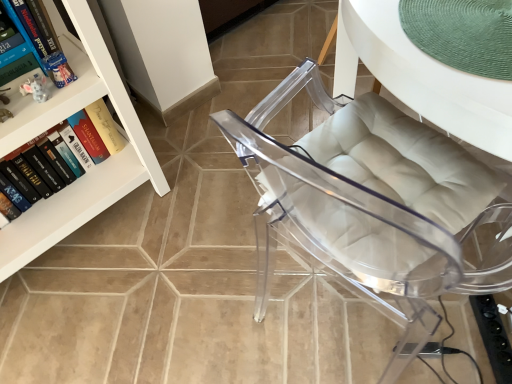
The height and width of the screenshot is (384, 512). What do you see at coordinates (86, 138) in the screenshot?
I see `hardcover book at left, acting as the first book starting from the bottom` at bounding box center [86, 138].

This screenshot has height=384, width=512. What do you see at coordinates (27, 29) in the screenshot?
I see `hardcover book at upper left, arranged as the 2th book when ordered from the bottom` at bounding box center [27, 29].

Describe the element at coordinates (59, 122) in the screenshot. I see `white glossy bookcase at upper left` at that location.

Where is `green woven placemat at upper right`? Image resolution: width=512 pixels, height=384 pixels. green woven placemat at upper right is located at coordinates (421, 77).

Identify the location of hardcover book at left, which is counted as the 2th book, starting from the top. This screenshot has width=512, height=384. (86, 138).

Is hardcover book at left, which is counted as the 2th book, starting from the top, facing away from white glossy bookcase at upper left?

Correct, hardcover book at left, which is counted as the 2th book, starting from the top, is looking away from white glossy bookcase at upper left.

Is hardcover book at left, which is counted as the 2th book, starting from the top, completely or partially outside of white glossy bookcase at upper left?

That's incorrect, hardcover book at left, which is counted as the 2th book, starting from the top, is not completely outside white glossy bookcase at upper left.

Which of these two, hardcover book at left, which is counted as the 2th book, starting from the top, or white glossy bookcase at upper left, is smaller?

hardcover book at left, which is counted as the 2th book, starting from the top.

Considering the positions of point (82, 129) and point (25, 246), is point (82, 129) closer or farther from the camera than point (25, 246)?

Point (82, 129) is farther from the camera than point (25, 246).

This screenshot has width=512, height=384. What are the coordinates of `chair above the hardcover book at left, acting as the first book starting from the bottom (from a real-world perspective)` in the screenshot? It's located at (348, 226).

Which is nearer, (104,130) or (453,237)?

The point (453,237) is closer to the camera.

Can you confirm if hardcover book at left, which is counted as the 2th book, starting from the top, is wider than transparent acrylic chair at center?

No.

From the image's perspective, relative to transparent acrylic chair at center, is hardcover book at left, acting as the first book starting from the bottom, above or below?

hardcover book at left, acting as the first book starting from the bottom, is situated lower than transparent acrylic chair at center in the image.

Which of these two, hardcover book at left, which is counted as the 2th book, starting from the top, or hardcover book at upper left, arranged as the 2th book when ordered from the bottom, is smaller?

hardcover book at upper left, arranged as the 2th book when ordered from the bottom.

Consider the image. Can you confirm if hardcover book at left, acting as the first book starting from the bottom, is positioned to the left of hardcover book at upper left, which appears as the first book when viewed from the top?

Yes.

Is hardcover book at left, which is counted as the 2th book, starting from the top, aimed at hardcover book at upper left, which appears as the first book when viewed from the top?

No.

Looking at this image, from a real-world perspective, which is physically above, hardcover book at upper left, arranged as the 2th book when ordered from the bottom, or white glossy bookcase at upper left?

A: hardcover book at upper left, arranged as the 2th book when ordered from the bottom.

Could you measure the distance between hardcover book at upper left, arranged as the 2th book when ordered from the bottom, and white glossy bookcase at upper left?

They are 9.41 inches apart.

At what (x,y) coordinates should I click in order to perform the action: click on book located above the white glossy bookcase at upper left (from the image's perspective). Please return your answer as a coordinate pair (x, y). Image resolution: width=512 pixels, height=384 pixels. Looking at the image, I should click on (27, 29).

Considering the sizes of objects hardcover book at upper left, which appears as the first book when viewed from the top, and white glossy bookcase at upper left in the image provided, who is wider, hardcover book at upper left, which appears as the first book when viewed from the top, or white glossy bookcase at upper left?

Wider between the two is white glossy bookcase at upper left.

Is green woven placemat at upper right inside transparent acrylic chair at center?

That's correct, green woven placemat at upper right is inside transparent acrylic chair at center.

Is transparent acrylic chair at center positioned far away from green woven placemat at upper right?

transparent acrylic chair at center is actually quite close to green woven placemat at upper right.

How much distance is there between transparent acrylic chair at center and green woven placemat at upper right?

The distance of transparent acrylic chair at center from green woven placemat at upper right is 26.10 centimeters.

Considering the relative sizes of transparent acrylic chair at center and green woven placemat at upper right in the image provided, is transparent acrylic chair at center taller than green woven placemat at upper right?

Yes.

You are a GUI agent. You are given a task and a screenshot of the screen. Output one action in this format:
    pyautogui.click(x=<x>, y=<y>)
    Task: Click on the bookcase lying above the hardcover book at left, which is counted as the 2th book, starting from the top (from the image's perspective)
    
    Given the screenshot: What is the action you would take?
    pyautogui.click(x=59, y=122)

Looking at this image, is white glossy bookcase at upper left turned away from hardcover book at left, acting as the first book starting from the bottom?

Yes.

How much distance is there between white glossy bookcase at upper left and hardcover book at left, acting as the first book starting from the bottom?

They are 5.02 inches apart.

In the scene shown: From the image's perspective, which object appears higher, white glossy bookcase at upper left or hardcover book at left, which is counted as the 2th book, starting from the top?

white glossy bookcase at upper left appears higher in the image.

From the image's perspective, is green woven placemat at upper right above or below white glossy bookcase at upper left?

From the image's perspective, green woven placemat at upper right appears above white glossy bookcase at upper left.

Would you say green woven placemat at upper right is outside white glossy bookcase at upper left?

green woven placemat at upper right is positioned outside white glossy bookcase at upper left.

Can you tell me how much green woven placemat at upper right and white glossy bookcase at upper left differ in facing direction?

107 degrees separate the facing orientations of green woven placemat at upper right and white glossy bookcase at upper left.

At what (x,y) coordinates should I click in order to perform the action: click on the 2nd book behind the white glossy bookcase at upper left. Please return your answer as a coordinate pair (x, y). This screenshot has width=512, height=384. Looking at the image, I should click on (86, 138).

The width and height of the screenshot is (512, 384). I want to click on chair that appears in front of the hardcover book at left, which is counted as the 2th book, starting from the top, so click(x=348, y=226).

Based on their spatial positions, is white glossy bookcase at upper left or green woven placemat at upper right closer to hardcover book at upper left, which appears as the first book when viewed from the top?

white glossy bookcase at upper left.

Based on their spatial positions, is white glossy bookcase at upper left or hardcover book at upper left, which appears as the first book when viewed from the top, closer to hardcover book at left, which is counted as the 2th book, starting from the top?

white glossy bookcase at upper left lies closer to hardcover book at left, which is counted as the 2th book, starting from the top, than the other object.

Which object lies nearer to the anchor point white glossy bookcase at upper left, hardcover book at left, acting as the first book starting from the bottom, or green woven placemat at upper right?

Among the two, hardcover book at left, acting as the first book starting from the bottom, is located nearer to white glossy bookcase at upper left.

Which object lies further to the anchor point hardcover book at left, which is counted as the 2th book, starting from the top, transparent acrylic chair at center or green woven placemat at upper right?

green woven placemat at upper right is further to hardcover book at left, which is counted as the 2th book, starting from the top.

Which object lies further to the anchor point hardcover book at left, acting as the first book starting from the bottom, white glossy bookcase at upper left or green woven placemat at upper right?

Among the two, green woven placemat at upper right is located further to hardcover book at left, acting as the first book starting from the bottom.

When comparing their distances from transparent acrylic chair at center, does white glossy bookcase at upper left or hardcover book at left, which is counted as the 2th book, starting from the top, seem closer?

Among the two, white glossy bookcase at upper left is located nearer to transparent acrylic chair at center.

Looking at the image, which one is located closer to white glossy bookcase at upper left, green woven placemat at upper right or hardcover book at left, which is counted as the 2th book, starting from the top?

Based on the image, hardcover book at left, which is counted as the 2th book, starting from the top, appears to be nearer to white glossy bookcase at upper left.

Looking at the image, which one is located closer to hardcover book at upper left, which appears as the first book when viewed from the top, green woven placemat at upper right or transparent acrylic chair at center?

Among the two, transparent acrylic chair at center is located nearer to hardcover book at upper left, which appears as the first book when viewed from the top.

Where is `table situated between hardcover book at upper left, arranged as the 2th book when ordered from the bottom, and transparent acrylic chair at center from left to right`? table situated between hardcover book at upper left, arranged as the 2th book when ordered from the bottom, and transparent acrylic chair at center from left to right is located at coordinates (421, 77).

Where is `book between white glossy bookcase at upper left and hardcover book at left, which is counted as the 2th book, starting from the top, along the z-axis`? book between white glossy bookcase at upper left and hardcover book at left, which is counted as the 2th book, starting from the top, along the z-axis is located at coordinates (27, 29).

Image resolution: width=512 pixels, height=384 pixels. I want to click on book between hardcover book at left, which is counted as the 2th book, starting from the top, and transparent acrylic chair at center from left to right, so click(27, 29).

Locate an element on the screen. table between hardcover book at left, acting as the first book starting from the bottom, and transparent acrylic chair at center is located at coordinates (421, 77).